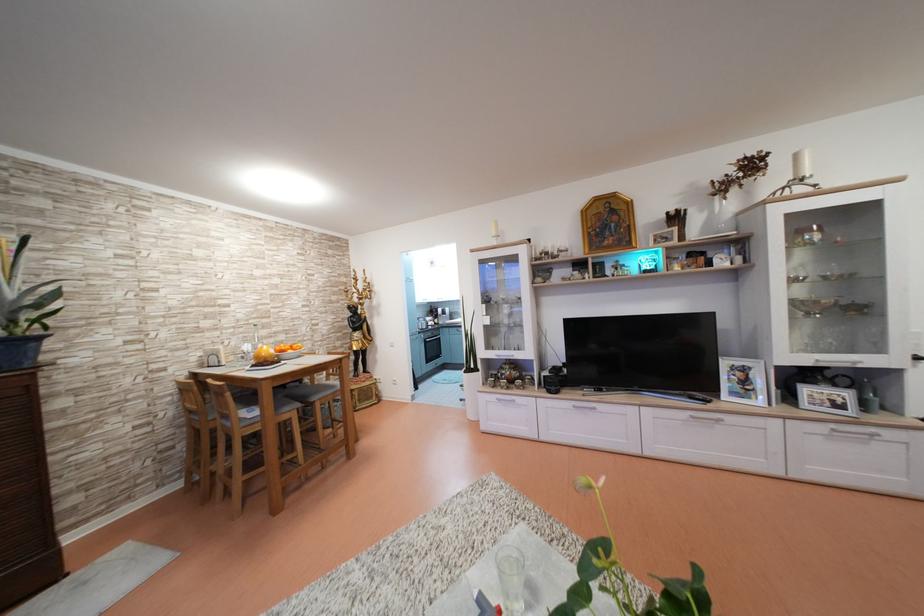
The height and width of the screenshot is (616, 924). In order to click on clear glass bottle in this screenshot , I will do `click(511, 578)`.